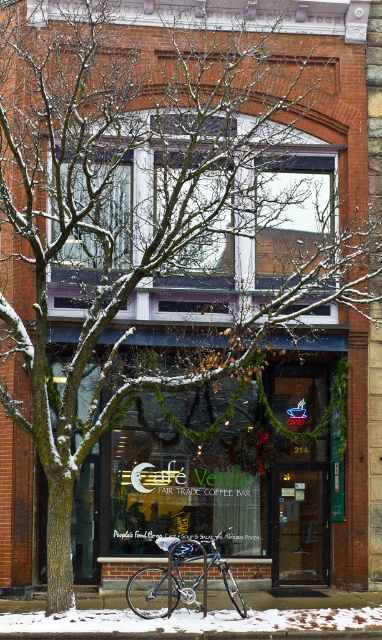
Question: Among these points, which one is farthest from the camera?

Choices:
 (A) (197, 634)
 (B) (150, 589)

Answer: (B)

Question: Which point is closer to the camera?

Choices:
 (A) white powdery snow at lower center
 (B) shiny blue bicycle at center

Answer: (A)

Question: Considering the relative positions of white powdery snow at lower center and shiny blue bicycle at center in the image provided, where is white powdery snow at lower center located with respect to shiny blue bicycle at center?

Choices:
 (A) below
 (B) above

Answer: (A)

Question: Is white powdery snow at lower center below shiny blue bicycle at center?

Choices:
 (A) no
 (B) yes

Answer: (B)

Question: Does white powdery snow at lower center appear on the left side of shiny blue bicycle at center?

Choices:
 (A) yes
 (B) no

Answer: (B)

Question: Which object appears farthest from the camera in this image?

Choices:
 (A) shiny blue bicycle at center
 (B) white powdery snow at lower center

Answer: (A)